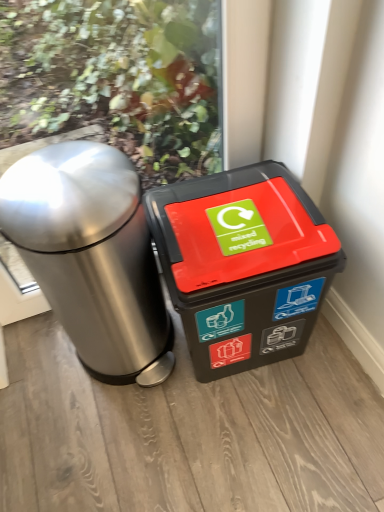
Identify the location of free location in front of black plastic recycling bin at center, marked as the first waste container in a right-to-left arrangement. This screenshot has height=512, width=384. (255, 432).